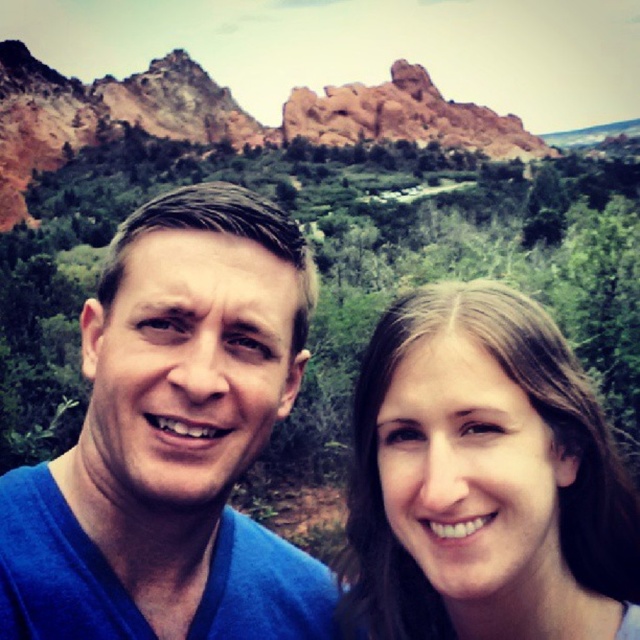
You are a photographer trying to capture a portrait of the two people in the image. You notice the blue fabric at center and the smooth brown hair at center are both in the frame. Which object is positioned closer to the camera?

The blue fabric at center is closer to the viewer than the smooth brown hair at center, so the blue fabric at center will appear closer to the camera in the portrait.